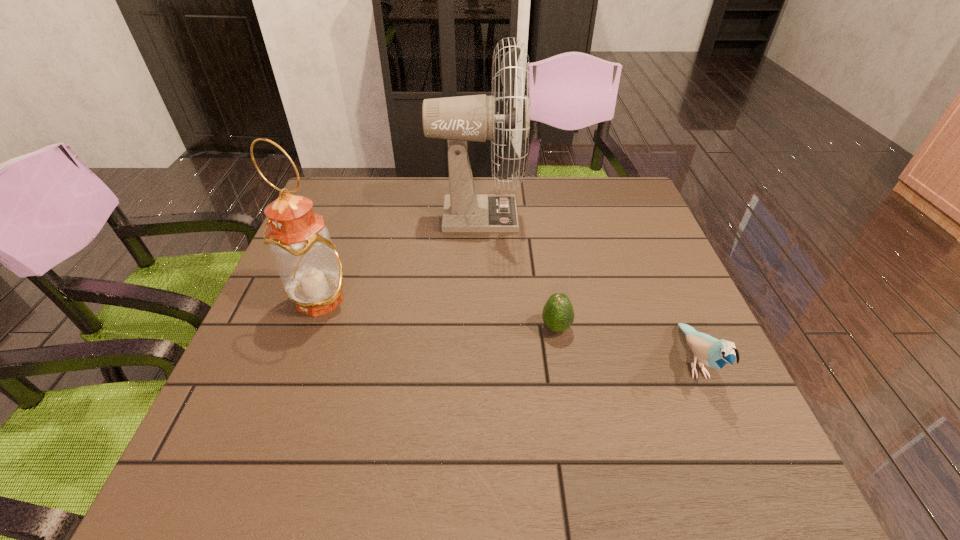
This screenshot has width=960, height=540. What are the coordinates of `vacant space situated at the face of the rightmost object` in the screenshot? It's located at (735, 457).

What are the coordinates of `free location located on the front of the shortest object` in the screenshot? It's located at (564, 376).

Identify the location of object located in the far edge section of the desktop. (459, 119).

The height and width of the screenshot is (540, 960). I want to click on object present at the left edge, so click(x=310, y=269).

Identify the location of object that is at the right edge. (712, 352).

At what (x,y) coordinates should I click in order to perform the action: click on free space at the far edge of the desktop. Please return your answer as a coordinate pair (x, y). The height and width of the screenshot is (540, 960). Looking at the image, I should click on (572, 205).

In the image, there is a desktop. At what (x,y) coordinates should I click in order to perform the action: click on vacant space at the near edge. Please return your answer as a coordinate pair (x, y). This screenshot has width=960, height=540. Looking at the image, I should click on (473, 442).

Where is `vacant region at the left edge of the desktop`? vacant region at the left edge of the desktop is located at coordinates (245, 395).

Locate an element on the screen. The height and width of the screenshot is (540, 960). vacant space at the right edge is located at coordinates (735, 411).

Locate an element on the screen. free spot at the far left corner of the desktop is located at coordinates (329, 177).